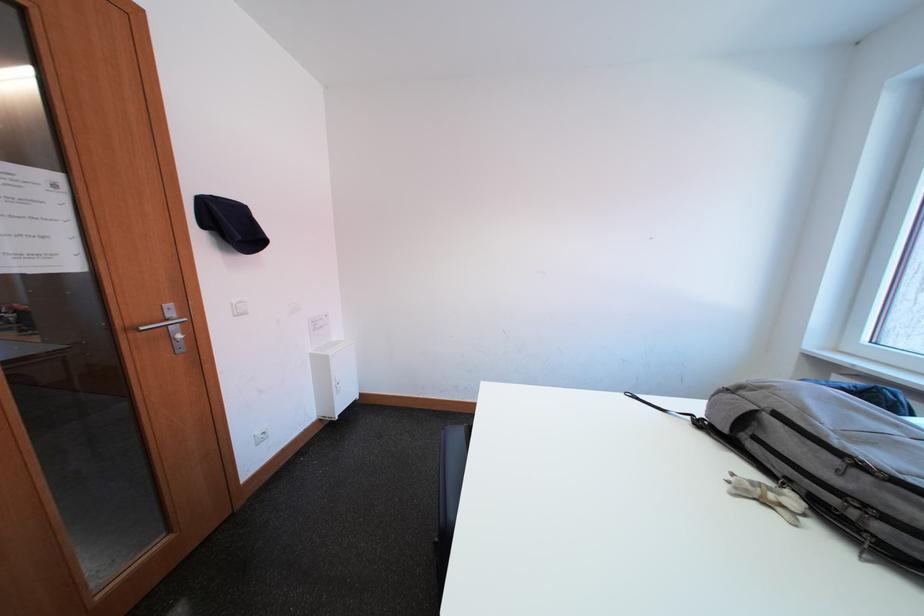
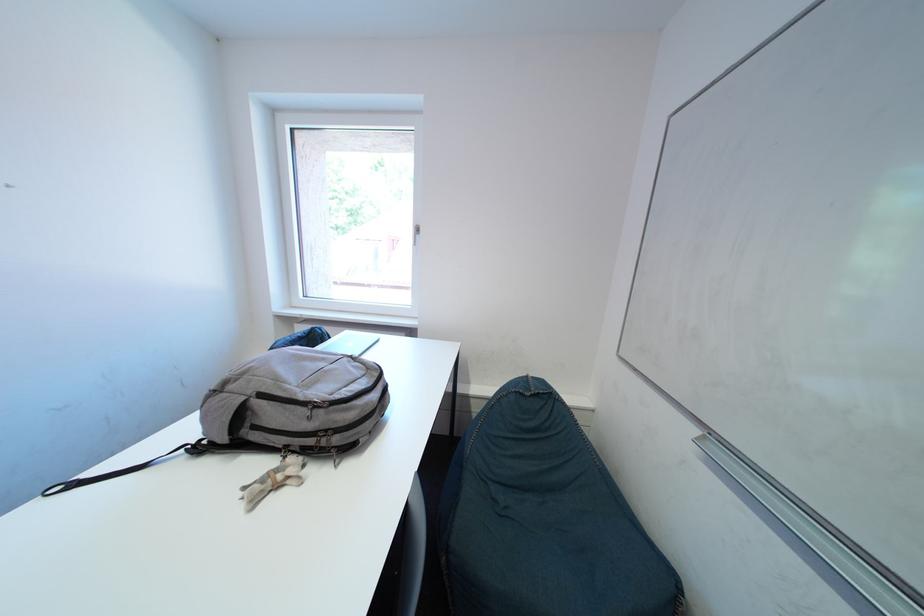
Question: The camera is either moving clockwise (left) or counter-clockwise (right) around the object. The first image is from the beginning of the video and the second image is from the end. Is the camera moving left or right when shooting the video?

Choices:
 (A) Left
 (B) Right

Answer: (A)